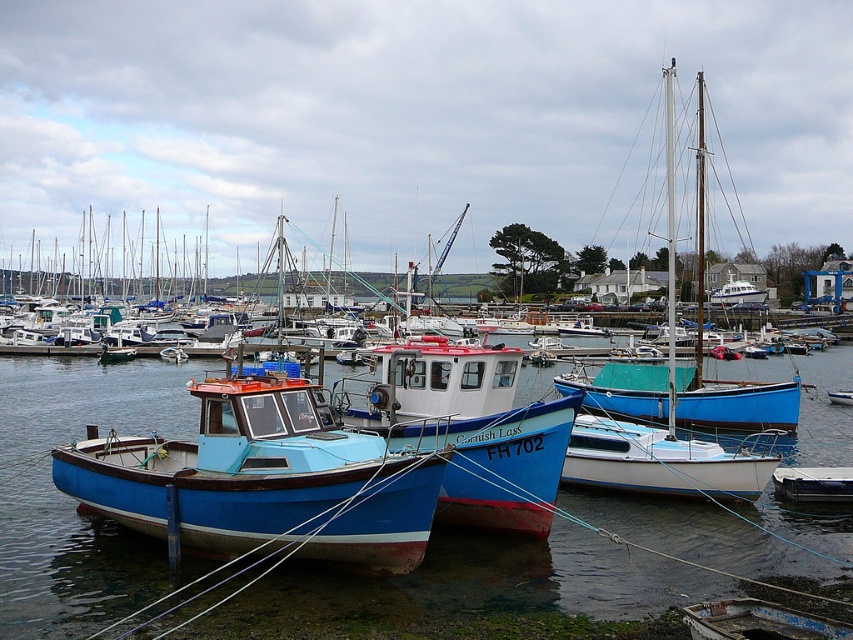
Question: Which point appears closest to the camera in this image?

Choices:
 (A) (283, 477)
 (B) (666, 67)

Answer: (A)

Question: Does matte blue boat at center lie in front of metallic blue dinghy at lower right?

Choices:
 (A) yes
 (B) no

Answer: (A)

Question: Which of the following is the farthest from the observer?

Choices:
 (A) teal wooden sailboat at center
 (B) matte blue boat at center

Answer: (A)

Question: Can you confirm if blue matte water at center is positioned below teal wooden sailboat at center?

Choices:
 (A) yes
 (B) no

Answer: (A)

Question: Which point is closer to the camera?

Choices:
 (A) (792, 493)
 (B) (6, 506)
 (C) (132, 442)

Answer: (C)

Question: From the image, what is the correct spatial relationship of blue matte water at center in relation to metallic blue dinghy at lower right?

Choices:
 (A) above
 (B) below

Answer: (A)